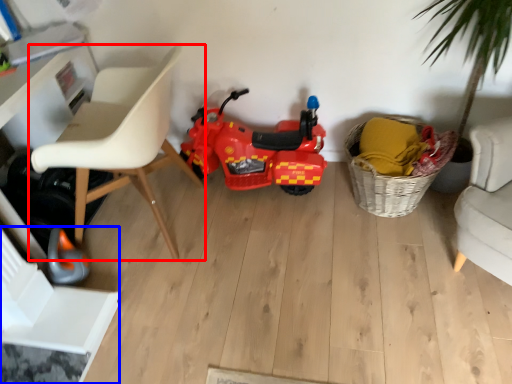
Question: Which object is closer to the camera taking this photo, chair (highlighted by a red box) or swivel chair (highlighted by a blue box)?

Choices:
 (A) chair
 (B) swivel chair

Answer: (A)